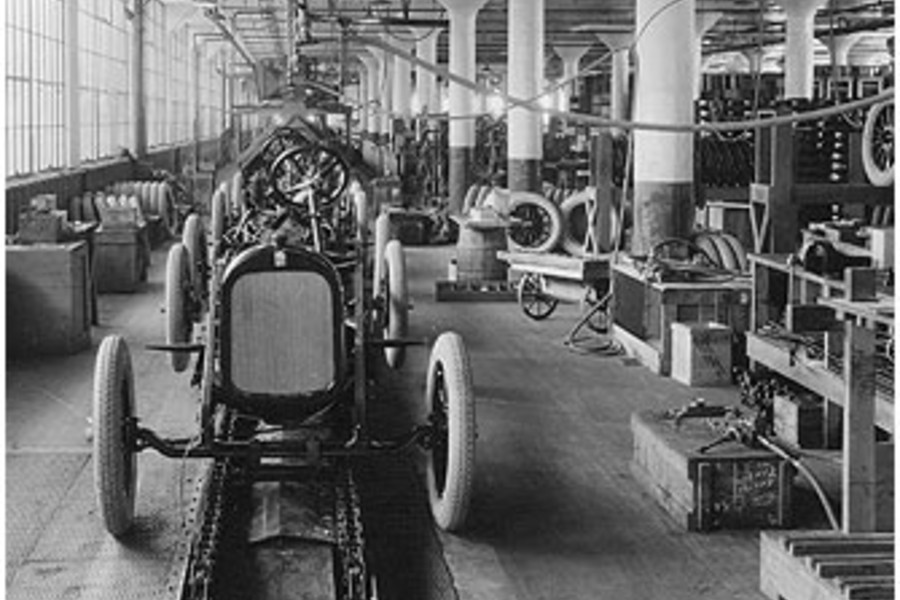
Where is `floor`? floor is located at coordinates (536, 386).